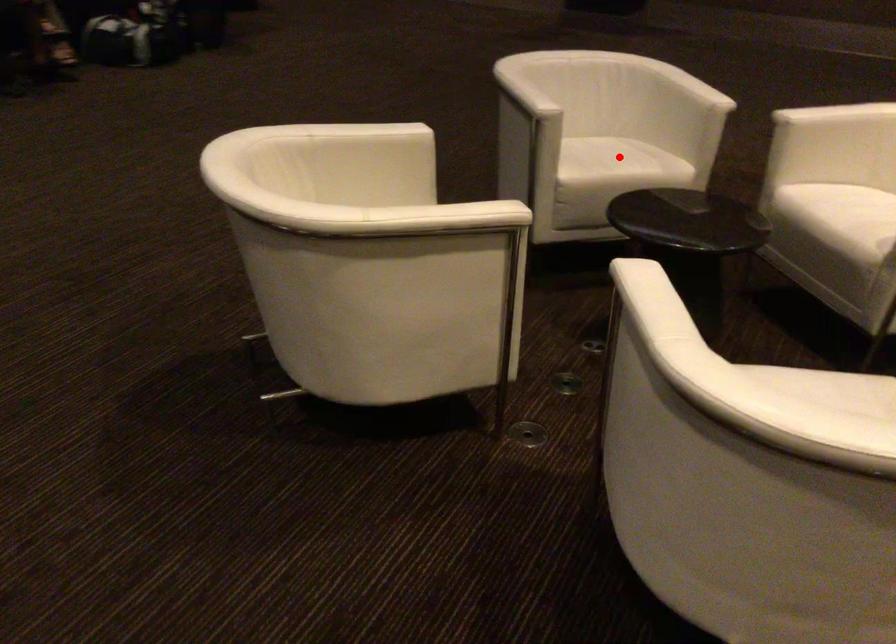
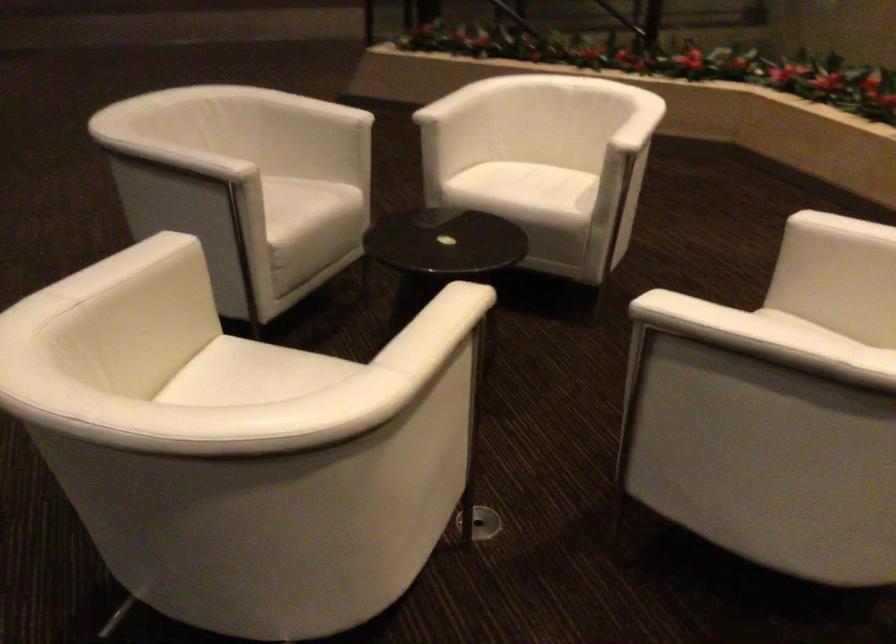
The point at the highlighted location is marked in the first image. Where is the corresponding point in the second image?

(306, 205)